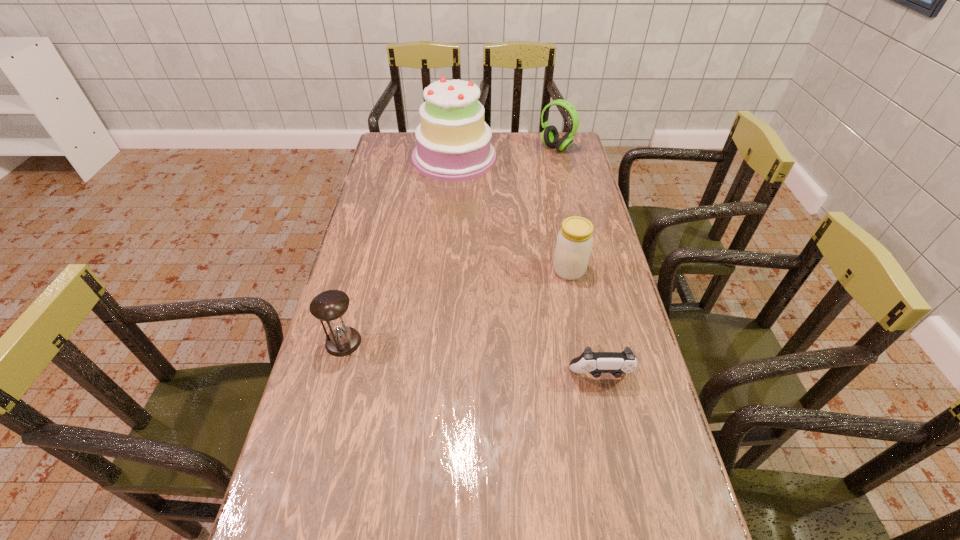
You are a GUI agent. You are given a task and a screenshot of the screen. Output one action in this format:
    pyautogui.click(x=<x>, y=<y>)
    Task: Click on the cake
    The image size is (960, 540).
    Given the screenshot: What is the action you would take?
    pyautogui.click(x=453, y=143)

The height and width of the screenshot is (540, 960). I want to click on the tallest object, so click(x=453, y=143).

Where is `headset`? The image size is (960, 540). headset is located at coordinates (550, 136).

I want to click on the third farthest object, so point(574,242).

Image resolution: width=960 pixels, height=540 pixels. Identify the location of the second shortest object. (330, 306).

What are the coordinates of `the leftmost object` in the screenshot? It's located at (330, 306).

The image size is (960, 540). In order to click on control in this screenshot , I will do `click(595, 363)`.

Identify the location of the shortest object. The image size is (960, 540). point(595,363).

Find the location of a particular element. Image resolution: width=960 pixels, height=540 pixels. free spot located on the right of the tallest object is located at coordinates (533, 158).

At what (x,y) coordinates should I click in order to perform the action: click on vacant space situated on the left of the headset. Please return your answer as a coordinate pair (x, y). Looking at the image, I should click on (489, 148).